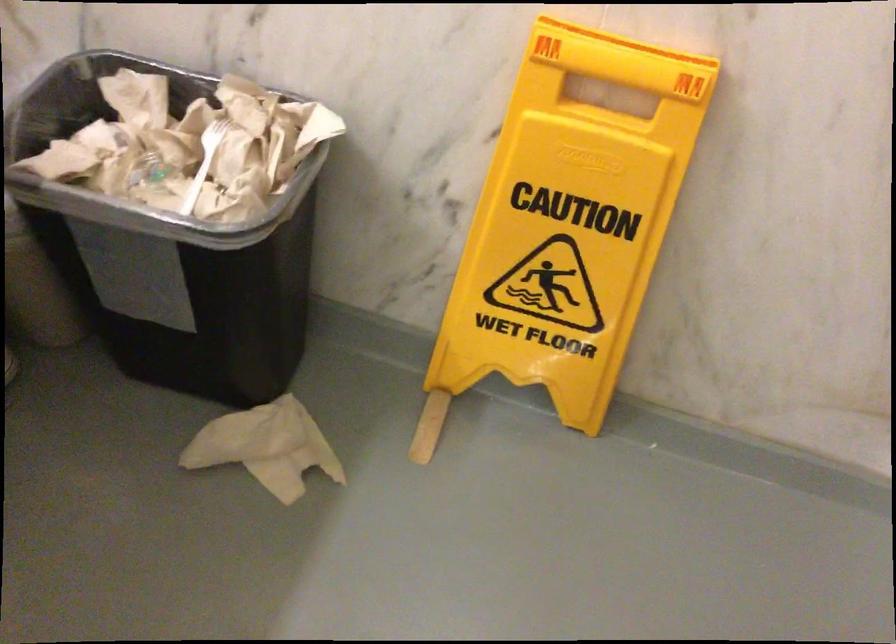
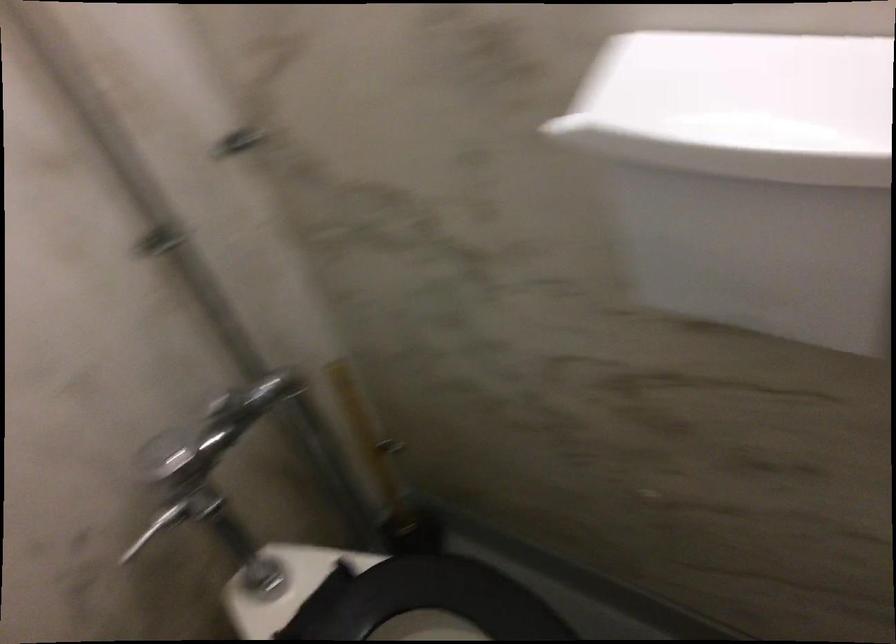
The images are taken continuously from a first-person perspective. In which direction is your viewpoint rotating?

The rotation direction of the camera is left-down.